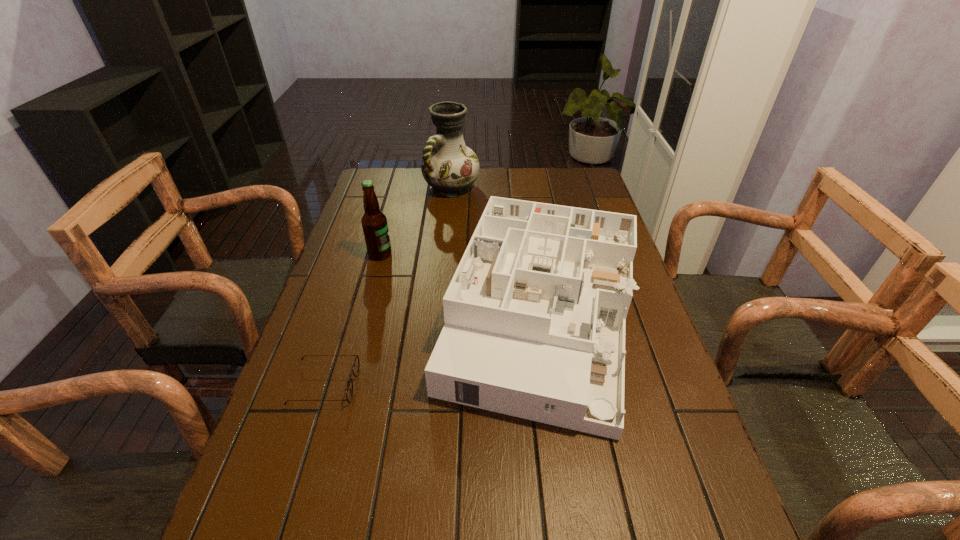
Where is `beer bottle present at the left edge`? beer bottle present at the left edge is located at coordinates (374, 222).

Find the location of a particular element. The height and width of the screenshot is (540, 960). sunglasses located at the left edge is located at coordinates (349, 393).

Find the location of a particular element. The image size is (960, 540). object that is at the right edge is located at coordinates (535, 314).

In the image, there is a desktop. At what (x,y) coordinates should I click in order to perform the action: click on blank space at the far edge. Please return your answer as a coordinate pair (x, y). Looking at the image, I should click on (495, 170).

You are a GUI agent. You are given a task and a screenshot of the screen. Output one action in this format:
    pyautogui.click(x=<x>, y=<y>)
    Task: Click on the vacant space at the left edge of the desktop
    
    Given the screenshot: What is the action you would take?
    pyautogui.click(x=389, y=204)

This screenshot has width=960, height=540. What are the coordinates of `vacant space at the right edge of the desktop` in the screenshot? It's located at (697, 441).

You are a GUI agent. You are given a task and a screenshot of the screen. Output one action in this format:
    pyautogui.click(x=<x>, y=<y>)
    Task: Click on the vacant point at the far right corner
    
    Given the screenshot: What is the action you would take?
    pyautogui.click(x=555, y=177)

The width and height of the screenshot is (960, 540). Identify the location of blank region between the beer bottle and the shortest object. (352, 320).

Identify the location of free spot between the beer bottle and the sunglasses. (352, 320).

Identify the location of free space between the tallest object and the sunglasses. (388, 286).